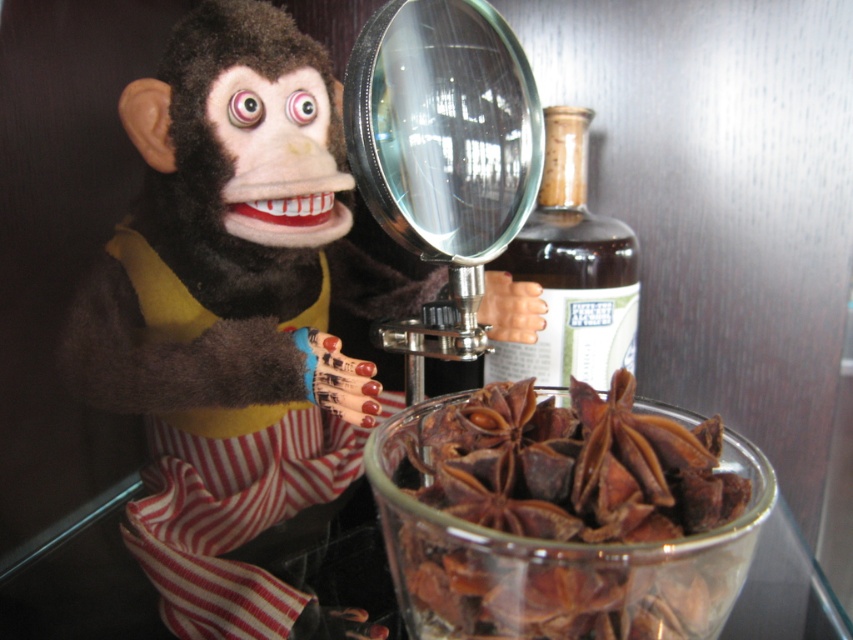
Can you confirm if velvet plush monkey at center is positioned below transparent glass magnifying glass at center?

Yes.

Between velvet plush monkey at center and transparent glass magnifying glass at center, which one is positioned higher?

transparent glass magnifying glass at center is higher up.

What do you see at coordinates (234, 314) in the screenshot?
I see `velvet plush monkey at center` at bounding box center [234, 314].

Locate an element on the screen. This screenshot has width=853, height=640. velvet plush monkey at center is located at coordinates (234, 314).

Who is positioned more to the right, velvet plush monkey at center or brown glass bottle at center?

Positioned to the right is brown glass bottle at center.

Does velvet plush monkey at center appear on the right side of brown glass bottle at center?

Incorrect, velvet plush monkey at center is not on the right side of brown glass bottle at center.

Find the location of `velvet plush monkey at center`. velvet plush monkey at center is located at coordinates (234, 314).

This screenshot has height=640, width=853. I want to click on velvet plush monkey at center, so click(x=234, y=314).

Which is below, brown papery star anise at center or brown glass bottle at center?

Positioned lower is brown papery star anise at center.

Does brown papery star anise at center appear on the left side of brown glass bottle at center?

Indeed, brown papery star anise at center is positioned on the left side of brown glass bottle at center.

Is point (730, 520) closer to camera compared to point (550, 236)?

Yes, point (730, 520) is closer to viewer.

Locate an element on the screen. This screenshot has height=640, width=853. brown papery star anise at center is located at coordinates (567, 518).